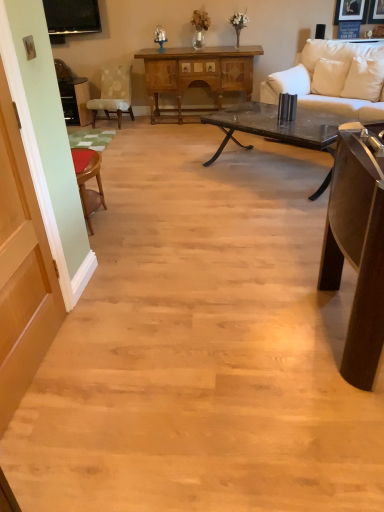
Question: Is light beige fabric chair at left oriented towards white leather couch at upper right?

Choices:
 (A) no
 (B) yes

Answer: (A)

Question: Is light beige fabric chair at left thinner than white leather couch at upper right?

Choices:
 (A) yes
 (B) no

Answer: (A)

Question: From a real-world perspective, is light beige fabric chair at left located beneath white leather couch at upper right?

Choices:
 (A) yes
 (B) no

Answer: (A)

Question: Is light beige fabric chair at left looking in the opposite direction of white leather couch at upper right?

Choices:
 (A) yes
 (B) no

Answer: (B)

Question: Considering the relative positions of light beige fabric chair at left and white leather couch at upper right in the image provided, is light beige fabric chair at left behind white leather couch at upper right?

Choices:
 (A) no
 (B) yes

Answer: (B)

Question: Which is correct: white leather couch at upper right is inside white leather pillow at upper right, which ranks as the 1th pillow in right-to-left order, or outside of it?

Choices:
 (A) inside
 (B) outside

Answer: (B)

Question: Based on their positions, is white leather couch at upper right located to the left or right of white leather pillow at upper right, which ranks as the 1th pillow in right-to-left order?

Choices:
 (A) right
 (B) left

Answer: (B)

Question: Is white leather couch at upper right wider or thinner than white leather pillow at upper right, marked as the third pillow in a left-to-right arrangement?

Choices:
 (A) thin
 (B) wide

Answer: (B)

Question: Is white leather couch at upper right bigger or smaller than white leather pillow at upper right, which ranks as the 1th pillow in right-to-left order?

Choices:
 (A) big
 (B) small

Answer: (A)

Question: From the image's perspective, is white leather couch at upper right positioned above or below black glass coffee table at center?

Choices:
 (A) below
 (B) above

Answer: (B)

Question: Considering the positions of point (309, 84) and point (292, 136), is point (309, 84) closer or farther from the camera than point (292, 136)?

Choices:
 (A) farther
 (B) closer

Answer: (A)

Question: In terms of height, does white leather couch at upper right look taller or shorter compared to black glass coffee table at center?

Choices:
 (A) tall
 (B) short

Answer: (A)

Question: Is white leather couch at upper right wider or thinner than black glass coffee table at center?

Choices:
 (A) wide
 (B) thin

Answer: (A)

Question: Looking at their shapes, would you say black glass coffee table at center is wider or thinner than white leather couch at upper right?

Choices:
 (A) thin
 (B) wide

Answer: (A)

Question: Would you say black glass coffee table at center is inside or outside white leather couch at upper right?

Choices:
 (A) inside
 (B) outside

Answer: (B)